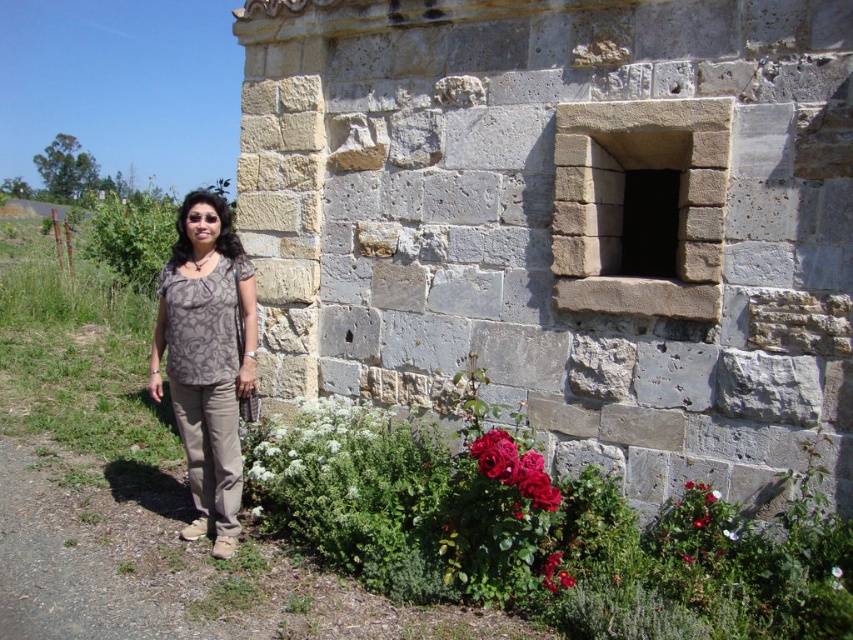
Can you confirm if shiny red roses at lower center is taller than red matte rose at lower center?

Yes.

Does shiny red roses at lower center lie in front of red matte rose at lower center?

Yes, it is in front of red matte rose at lower center.

I want to click on shiny red roses at lower center, so click(514, 467).

Find the location of `shiny red roses at lower center`. shiny red roses at lower center is located at coordinates (514, 467).

Is gray stone window at center closer to the viewer compared to red matte rose at lower center?

No.

Between gray stone window at center and red matte rose at lower center, which one is positioned lower?

red matte rose at lower center is below.

Locate an element on the screen. This screenshot has width=853, height=640. gray stone window at center is located at coordinates (564, 218).

Does green leafy bush at lower center have a larger size compared to red matte rose at lower center?

Yes, green leafy bush at lower center is bigger than red matte rose at lower center.

Which is below, green leafy bush at lower center or red matte rose at lower center?

Positioned lower is red matte rose at lower center.

Between point (310, 436) and point (550, 579), which one is positioned in front?

Point (550, 579) is in front.

At what (x,y) coordinates should I click in order to perform the action: click on green leafy bush at lower center. Please return your answer as a coordinate pair (x, y). Looking at the image, I should click on (308, 438).